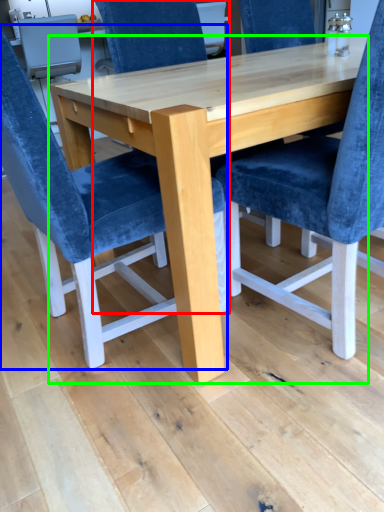
Question: Considering the real-world distances, which object is closest to chair (highlighted by a red box)? chair (highlighted by a blue box) or table (highlighted by a green box).

Choices:
 (A) chair
 (B) table

Answer: (B)